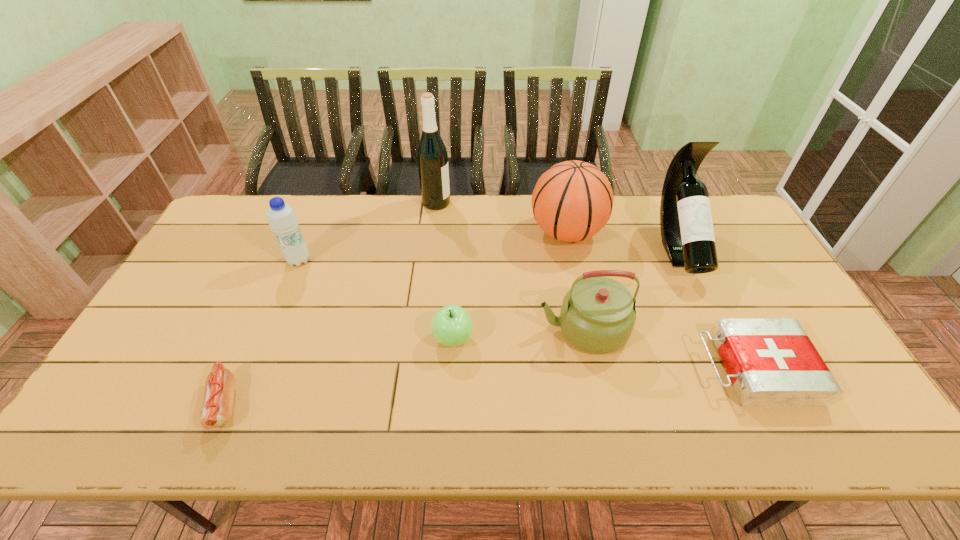
Identify the location of the left wine bottle. (432, 157).

Locate an element on the screen. the taller wine bottle is located at coordinates (432, 157).

Where is `the right wine bottle`? Image resolution: width=960 pixels, height=540 pixels. the right wine bottle is located at coordinates (687, 233).

This screenshot has height=540, width=960. Find the location of `the nearer wine bottle`. the nearer wine bottle is located at coordinates (687, 233).

Locate an element on the screen. basketball is located at coordinates (572, 201).

Image resolution: width=960 pixels, height=540 pixels. Identify the location of water bottle. (282, 219).

This screenshot has width=960, height=540. In order to click on kettle in this screenshot , I will do `click(598, 313)`.

Locate an element on the screen. This screenshot has height=540, width=960. apple is located at coordinates (452, 326).

Where is `the first-aid kit`? This screenshot has height=540, width=960. the first-aid kit is located at coordinates [771, 362].

Locate an element on the screen. sausage is located at coordinates (216, 410).